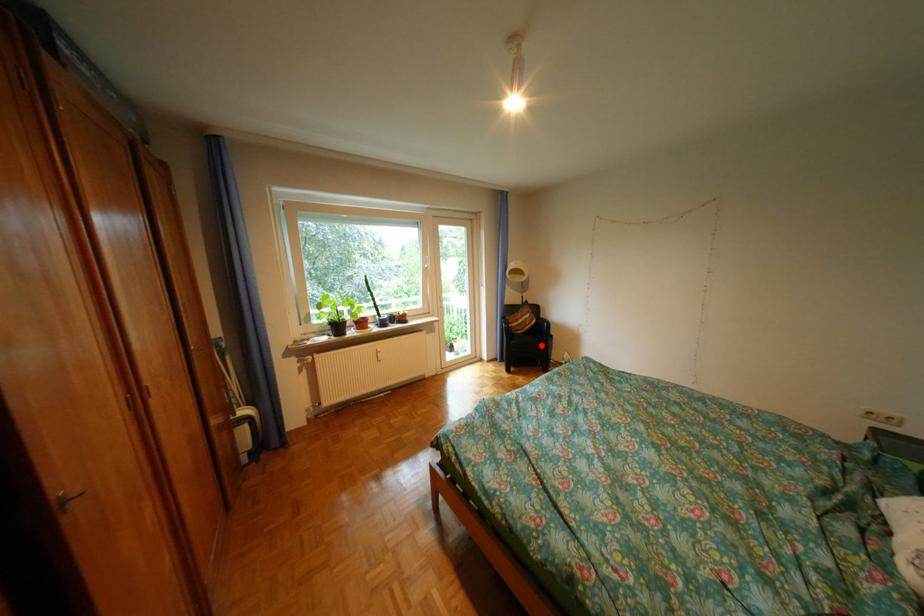
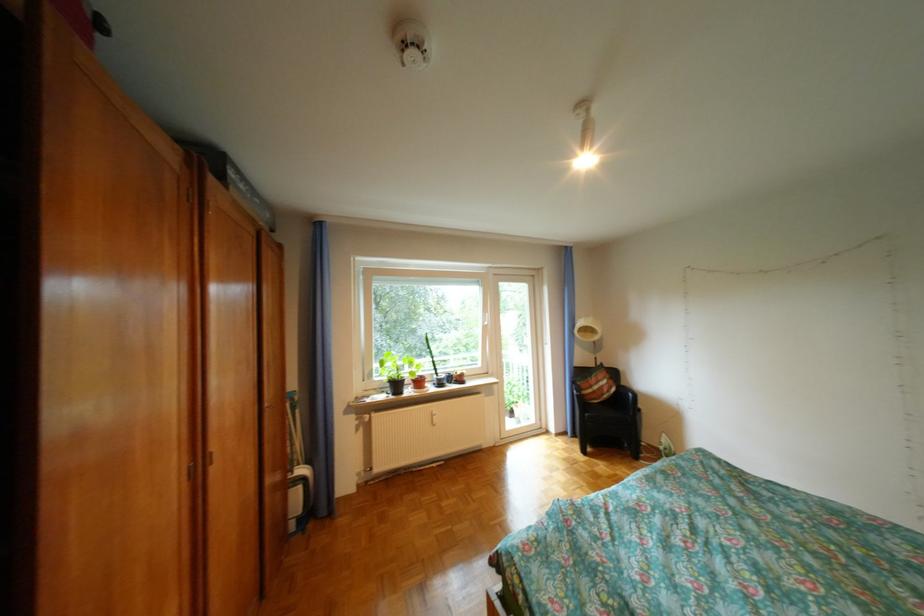
Locate, in the second image, the point that corresponds to the highlighted location in the first image.

(621, 419)